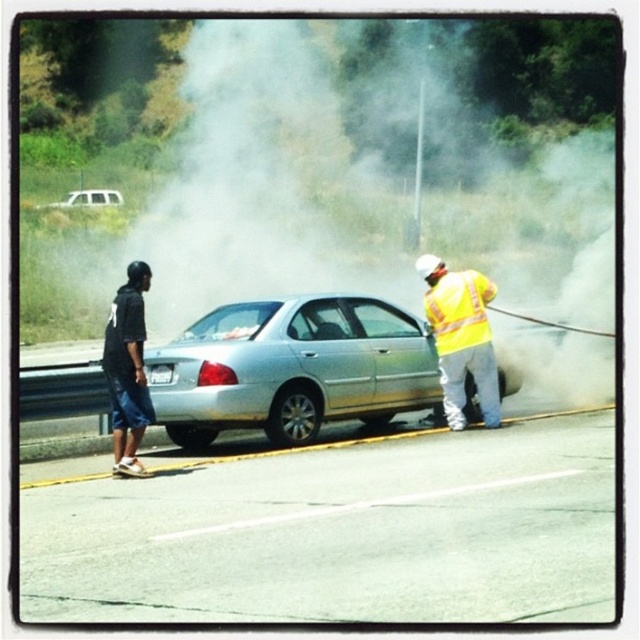
Question: Can you confirm if yellow reflective safety vest at center-right is wider than silver metallic suv at upper left?

Choices:
 (A) no
 (B) yes

Answer: (A)

Question: Among these points, which one is nearest to the camera?

Choices:
 (A) (440, 35)
 (B) (472, 300)
 (C) (525, 614)
 (D) (100, 196)

Answer: (C)

Question: Which object is farther from the camera taking this photo?

Choices:
 (A) yellow reflective safety vest at center-right
 (B) smooth asphalt highway at center
 (C) silver metallic car at center

Answer: (A)

Question: From the image, what is the correct spatial relationship of smoketransparent/gaseousatcenter in relation to silver metallic car at center?

Choices:
 (A) left
 (B) right

Answer: (A)

Question: Is smoketransparent/gaseousatcenter closer to camera compared to silver metallic car at center?

Choices:
 (A) yes
 (B) no

Answer: (A)

Question: Which is farther from the smooth asphalt highway at center?

Choices:
 (A) yellow reflective safety vest at center-right
 (B) smoketransparent/gaseousatcenter
 (C) silver metallic suv at upper left
 (D) silver metallic car at center

Answer: (C)